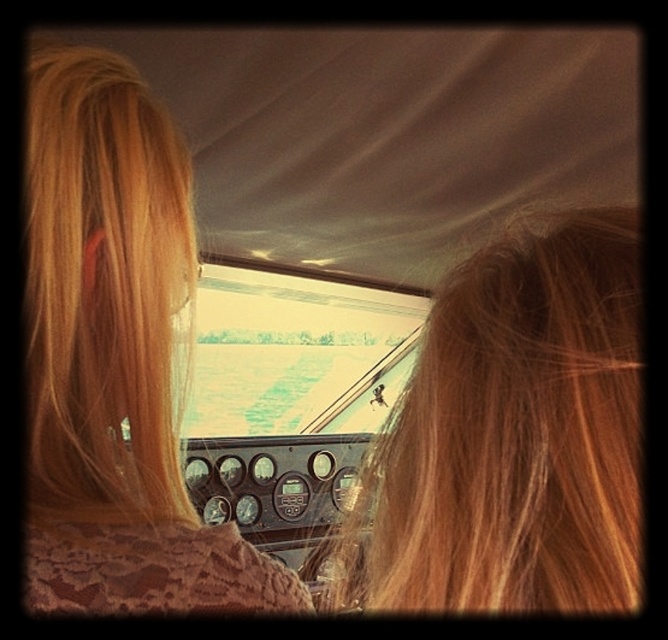
You are a passenger in the aircraft and want to see the cockpit dashboard clearly. Which person, the one with blonde hair at center or the one with blonde hair at left, is blocking your view less?

The blonde hair at center is in front of blonde hair at left, so the blonde hair at left is behind and therefore blocks less of your view. Therefore, the person with blonde hair at left is blocking your view less.